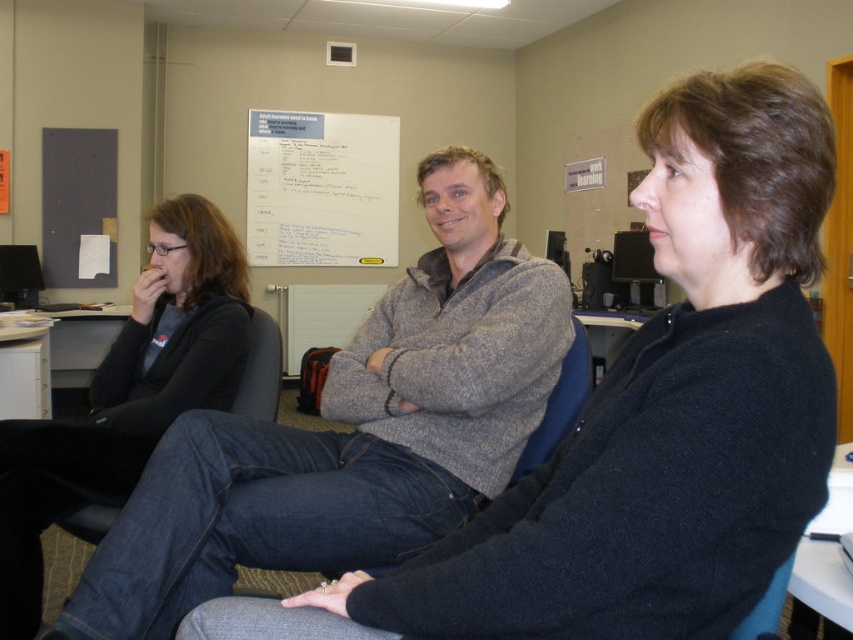
Does black sweater at left appear on the left side of white paperboard at upper center?

In fact, black sweater at left is to the right of white paperboard at upper center.

Is black sweater at left closer to the viewer compared to white paperboard at upper center?

That is True.

Where is `black sweater at left`? This screenshot has width=853, height=640. black sweater at left is located at coordinates (126, 394).

In the scene shown: Does dark blue sweater at center have a lesser height compared to white paperboard at upper center?

Indeed, dark blue sweater at center has a lesser height compared to white paperboard at upper center.

What do you see at coordinates (648, 417) in the screenshot? This screenshot has height=640, width=853. I see `dark blue sweater at center` at bounding box center [648, 417].

Who is more distant from viewer, [758,572] or [310,193]?

The point [310,193] is more distant.

The height and width of the screenshot is (640, 853). I want to click on dark blue sweater at center, so click(648, 417).

Which of these two, gray sweater at center or white paperboard at upper center, stands shorter?

gray sweater at center is shorter.

Which is behind, point (325, 396) or point (288, 224)?

The point (288, 224) is more distant.

Locate an element on the screen. The image size is (853, 640). gray sweater at center is located at coordinates (352, 432).